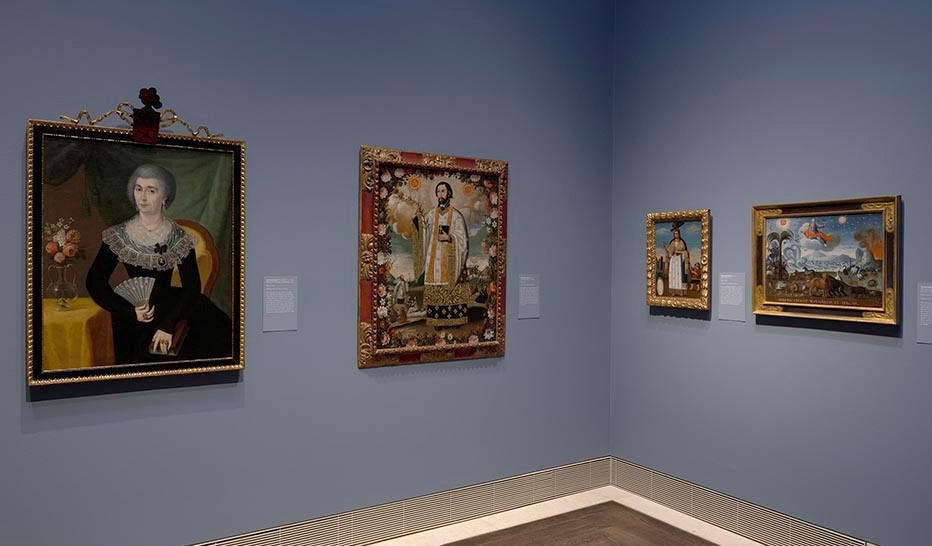
The image size is (932, 546). In order to click on blue paint in this screenshot , I will do `click(758, 396)`.